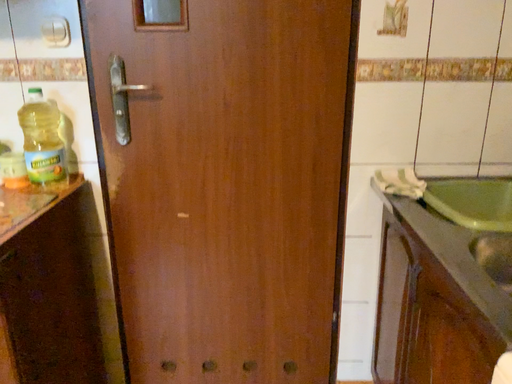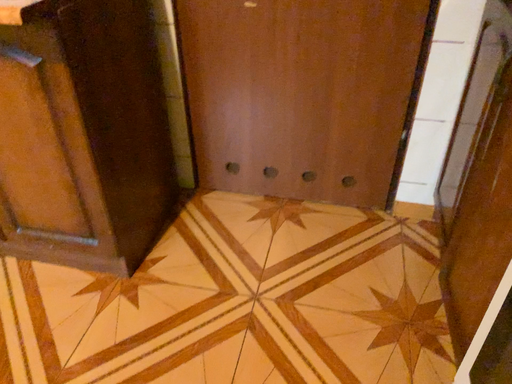
Question: Which way did the camera rotate in the video?

Choices:
 (A) rotated right
 (B) rotated left

Answer: (B)